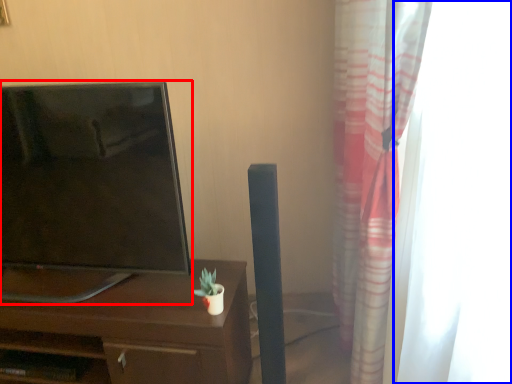
Question: Which of the following is the closest to the observer, television (highlighted by a red box) or glass door (highlighted by a blue box)?

Choices:
 (A) television
 (B) glass door

Answer: (B)